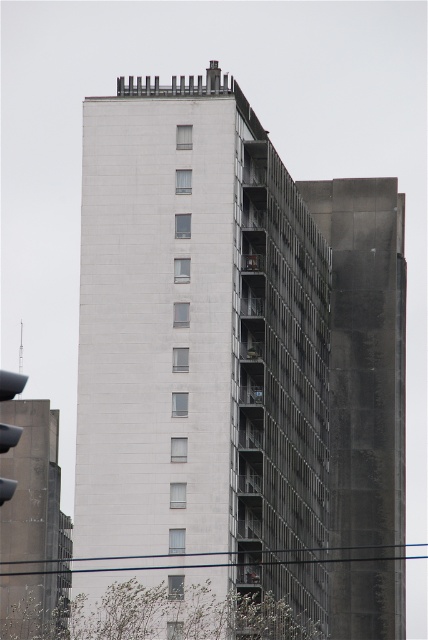
Does point (309, 212) come behind point (5, 381)?

Yes.

Does white concrete building at center have a larger size compared to matte black traffic light at left?

Actually, white concrete building at center might be smaller than matte black traffic light at left.

Consider the image. Measure the distance between white concrete building at center and camera.

white concrete building at center and camera are 112.97 meters apart from each other.

The image size is (428, 640). In order to click on white concrete building at center in this screenshot , I will do point(199,348).